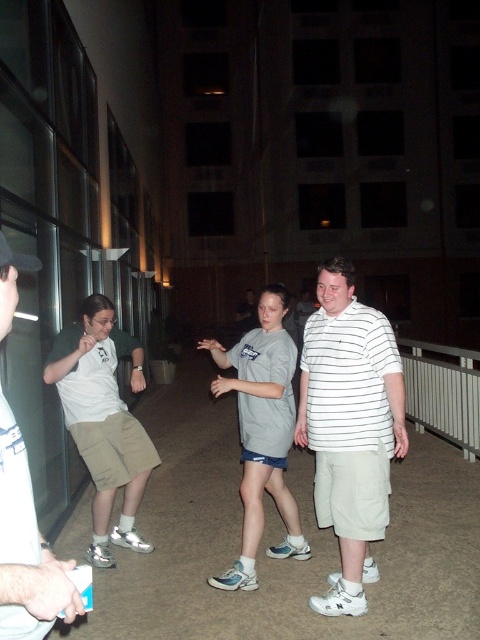
Question: Can you confirm if matte khaki shorts at left is positioned to the right of gray cotton t-shirt at center?

Choices:
 (A) yes
 (B) no

Answer: (B)

Question: Estimate the real-world distances between objects in this image. Which object is farther from the black fabric baseball hat at left?

Choices:
 (A) matte khaki shorts at left
 (B) white striped shirt at center
 (C) light brown shorts at left

Answer: (A)

Question: Among these points, which one is farthest from the camera?

Choices:
 (A) (265, 424)
 (B) (116, 448)
 (C) (36, 525)

Answer: (B)

Question: Can you confirm if light brown shorts at left is positioned above black fabric baseball hat at left?

Choices:
 (A) no
 (B) yes

Answer: (A)

Question: Considering the real-world distances, which object is closest to the matte khaki shorts at left?

Choices:
 (A) light brown shorts at left
 (B) gray cotton t-shirt at center
 (C) black fabric baseball hat at left

Answer: (B)

Question: Is gray cotton t-shirt at center wider than black fabric baseball hat at left?

Choices:
 (A) no
 (B) yes

Answer: (B)